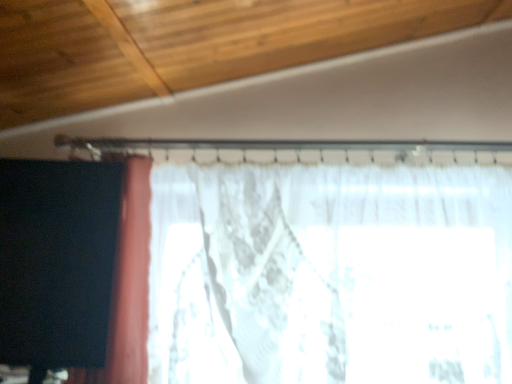
Where is `black matte curtain at left, the 2th curtain viewed from the right`? The image size is (512, 384). black matte curtain at left, the 2th curtain viewed from the right is located at coordinates (57, 261).

What do you see at coordinates (57, 261) in the screenshot?
I see `black matte curtain at left, the 2th curtain viewed from the right` at bounding box center [57, 261].

Looking at this image, how much space does black matte curtain at left, which is counted as the 1th curtain, starting from the left, occupy horizontally?

black matte curtain at left, which is counted as the 1th curtain, starting from the left, is 5.04 inches wide.

Where is `white lace curtain at left, acting as the 1th curtain starting from the right`? The image size is (512, 384). white lace curtain at left, acting as the 1th curtain starting from the right is located at coordinates (331, 275).

Describe the element at coordinates (331, 275) in the screenshot. I see `white lace curtain at left, acting as the 1th curtain starting from the right` at that location.

The image size is (512, 384). Find the location of `black matte curtain at left, which is counted as the 1th curtain, starting from the left`. black matte curtain at left, which is counted as the 1th curtain, starting from the left is located at coordinates (57, 261).

Is black matte curtain at left, which is counted as the 1th curtain, starting from the left, to the right of white lace curtain at left, acting as the 1th curtain starting from the right, from the viewer's perspective?

No.

Based on the photo, which object is further away from the camera taking this photo, black matte curtain at left, which is counted as the 1th curtain, starting from the left, or white lace curtain at left, acting as the 1th curtain starting from the right?

Positioned behind is white lace curtain at left, acting as the 1th curtain starting from the right.

Is point (52, 254) closer or farther from the camera than point (474, 302)?

Point (52, 254).

From the image's perspective, is black matte curtain at left, which is counted as the 1th curtain, starting from the left, above or below white lace curtain at left, the second curtain viewed from the left?

From the image's perspective, black matte curtain at left, which is counted as the 1th curtain, starting from the left, appears above white lace curtain at left, the second curtain viewed from the left.

From a real-world perspective, which is physically above, black matte curtain at left, the 2th curtain viewed from the right, or white lace curtain at left, acting as the 1th curtain starting from the right?

black matte curtain at left, the 2th curtain viewed from the right, is physically above.

Can you confirm if black matte curtain at left, which is counted as the 1th curtain, starting from the left, is wider than white lace curtain at left, acting as the 1th curtain starting from the right?

Incorrect, the width of black matte curtain at left, which is counted as the 1th curtain, starting from the left, does not surpass that of white lace curtain at left, acting as the 1th curtain starting from the right.

Which of these two, black matte curtain at left, which is counted as the 1th curtain, starting from the left, or white lace curtain at left, acting as the 1th curtain starting from the right, stands taller?

With more height is white lace curtain at left, acting as the 1th curtain starting from the right.

Considering the sizes of objects black matte curtain at left, which is counted as the 1th curtain, starting from the left, and white lace curtain at left, acting as the 1th curtain starting from the right, in the image provided, who is smaller, black matte curtain at left, which is counted as the 1th curtain, starting from the left, or white lace curtain at left, acting as the 1th curtain starting from the right,?

Smaller between the two is black matte curtain at left, which is counted as the 1th curtain, starting from the left.

Is black matte curtain at left, which is counted as the 1th curtain, starting from the left, outside of white lace curtain at left, acting as the 1th curtain starting from the right?

black matte curtain at left, which is counted as the 1th curtain, starting from the left, lies outside white lace curtain at left, acting as the 1th curtain starting from the right,'s area.

Based on the photo, would you consider black matte curtain at left, which is counted as the 1th curtain, starting from the left, to be distant from white lace curtain at left, acting as the 1th curtain starting from the right?

No, black matte curtain at left, which is counted as the 1th curtain, starting from the left, is not far away from white lace curtain at left, acting as the 1th curtain starting from the right.

Is black matte curtain at left, which is counted as the 1th curtain, starting from the left, facing away from white lace curtain at left, acting as the 1th curtain starting from the right?

That's right, black matte curtain at left, which is counted as the 1th curtain, starting from the left, is facing away from white lace curtain at left, acting as the 1th curtain starting from the right.

How different are the orientations of black matte curtain at left, which is counted as the 1th curtain, starting from the left, and white lace curtain at left, the second curtain viewed from the left, in degrees?

black matte curtain at left, which is counted as the 1th curtain, starting from the left, and white lace curtain at left, the second curtain viewed from the left, are facing 4.32 degrees away from each other.

Locate an element on the screen. This screenshot has height=384, width=512. curtain that appears in front of the white lace curtain at left, the second curtain viewed from the left is located at coordinates (57, 261).

Is white lace curtain at left, the second curtain viewed from the left, to the right of black matte curtain at left, which is counted as the 1th curtain, starting from the left, from the viewer's perspective?

Yes, white lace curtain at left, the second curtain viewed from the left, is to the right of black matte curtain at left, which is counted as the 1th curtain, starting from the left.

Who is more distant, white lace curtain at left, the second curtain viewed from the left, or black matte curtain at left, which is counted as the 1th curtain, starting from the left?

white lace curtain at left, the second curtain viewed from the left, is further from the camera.

Is point (303, 240) in front of point (102, 307)?

No.

From the image's perspective, is white lace curtain at left, the second curtain viewed from the left, beneath black matte curtain at left, the 2th curtain viewed from the right?

Yes, from the image's perspective, white lace curtain at left, the second curtain viewed from the left, is below black matte curtain at left, the 2th curtain viewed from the right.

From a real-world perspective, which object stands above the other?

black matte curtain at left, the 2th curtain viewed from the right.

Is white lace curtain at left, acting as the 1th curtain starting from the right, thinner than black matte curtain at left, which is counted as the 1th curtain, starting from the left?

In fact, white lace curtain at left, acting as the 1th curtain starting from the right, might be wider than black matte curtain at left, which is counted as the 1th curtain, starting from the left.

Between white lace curtain at left, acting as the 1th curtain starting from the right, and black matte curtain at left, which is counted as the 1th curtain, starting from the left, which one has more height?

white lace curtain at left, acting as the 1th curtain starting from the right, is taller.

Between white lace curtain at left, acting as the 1th curtain starting from the right, and black matte curtain at left, the 2th curtain viewed from the right, which one has smaller size?

black matte curtain at left, the 2th curtain viewed from the right.

Do you think white lace curtain at left, acting as the 1th curtain starting from the right, is within black matte curtain at left, the 2th curtain viewed from the right, or outside of it?

The correct answer is: outside.

Does white lace curtain at left, the second curtain viewed from the left, touch black matte curtain at left, which is counted as the 1th curtain, starting from the left?

white lace curtain at left, the second curtain viewed from the left, and black matte curtain at left, which is counted as the 1th curtain, starting from the left, are clearly separated.

Is white lace curtain at left, the second curtain viewed from the left, facing away from black matte curtain at left, the 2th curtain viewed from the right?

No, white lace curtain at left, the second curtain viewed from the left, is not facing the opposite direction of black matte curtain at left, the 2th curtain viewed from the right.

Can you tell me how much white lace curtain at left, acting as the 1th curtain starting from the right, and black matte curtain at left, the 2th curtain viewed from the right, differ in facing direction?

4.32 degrees.

At what (x,y) coordinates should I click in order to perform the action: click on curtain that appears above the white lace curtain at left, the second curtain viewed from the left (from the image's perspective). Please return your answer as a coordinate pair (x, y). This screenshot has height=384, width=512. Looking at the image, I should click on (57, 261).

Identify the location of curtain that is below the black matte curtain at left, the 2th curtain viewed from the right (from the image's perspective). (331, 275).

This screenshot has height=384, width=512. I want to click on curtain lying on the right of black matte curtain at left, which is counted as the 1th curtain, starting from the left, so click(331, 275).